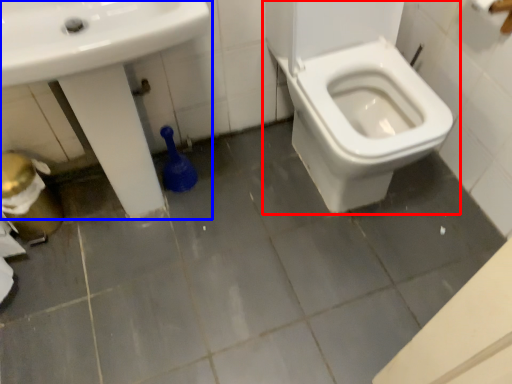
Question: Which of the following is the closest to the observer, toilet (highlighted by a red box) or sink (highlighted by a blue box)?

Choices:
 (A) toilet
 (B) sink

Answer: (B)